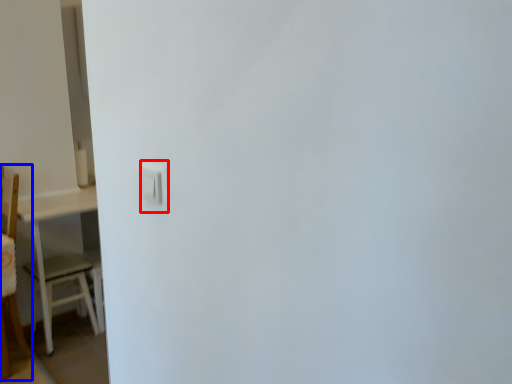
Question: Which object is further to the camera taking this photo, light switch (highlighted by a red box) or furniture (highlighted by a blue box)?

Choices:
 (A) light switch
 (B) furniture

Answer: (B)